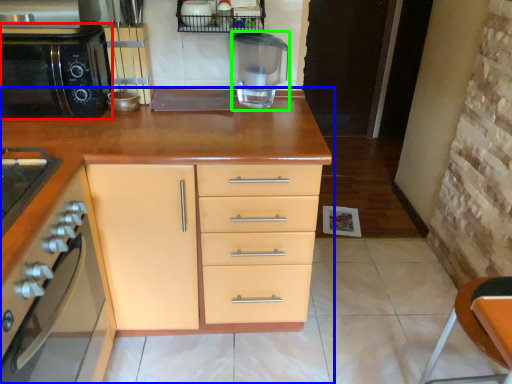
Question: Estimate the real-world distances between objects in this image. Which object is farther from home appliance (highlighted by a red box), cabinetry (highlighted by a blue box) or blender (highlighted by a green box)?

Choices:
 (A) cabinetry
 (B) blender

Answer: (B)